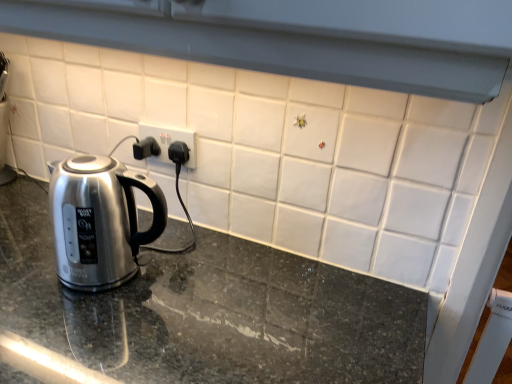
Locate an element on the screen. Image resolution: width=512 pixels, height=384 pixels. free space above granite countertop at center (from a real-world perspective) is located at coordinates (201, 316).